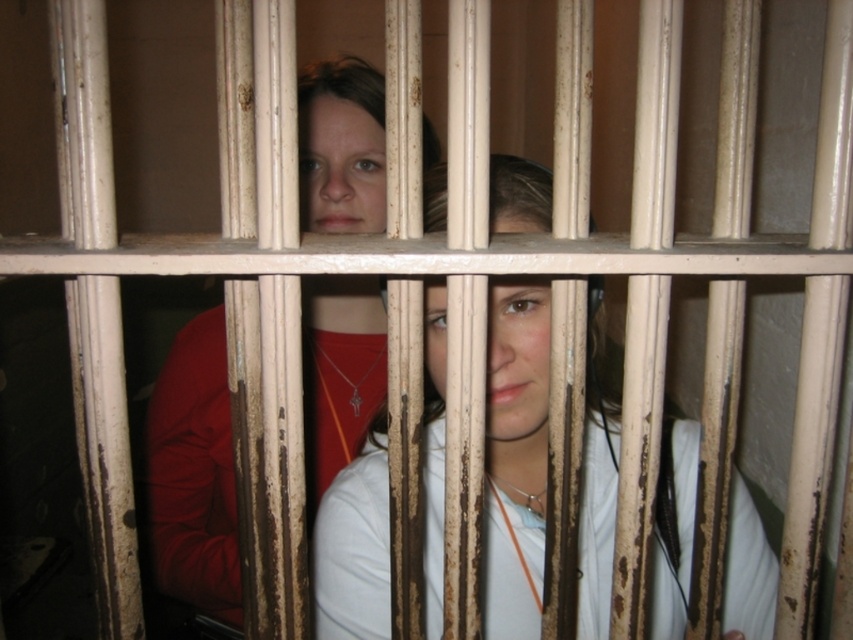
Is white matte shirt at center smaller than matte red shirt at center?

Indeed, white matte shirt at center has a smaller size compared to matte red shirt at center.

Between point (537, 506) and point (213, 465), which one is positioned behind?

Point (213, 465)

Where is `white matte shirt at center`? The height and width of the screenshot is (640, 853). white matte shirt at center is located at coordinates (515, 456).